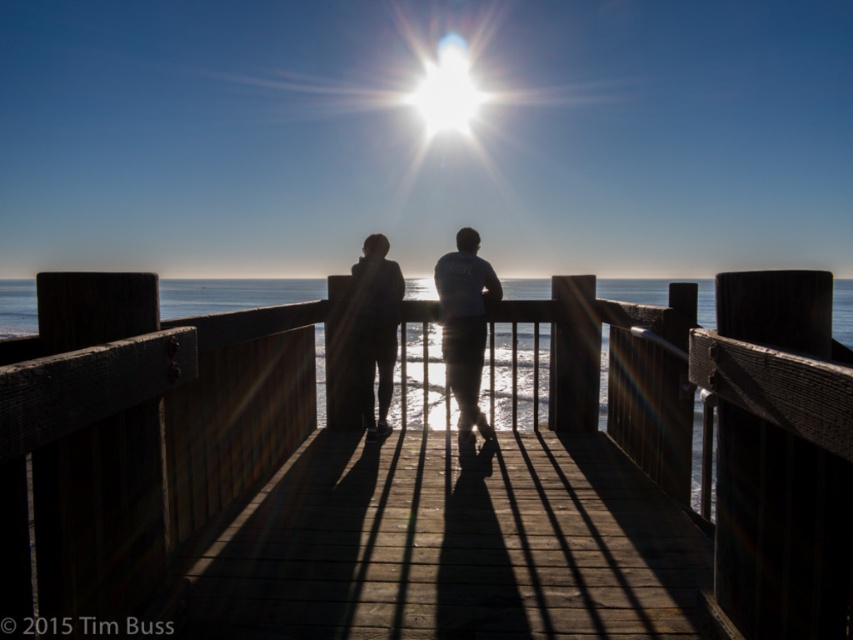
Question: Is transparent water at center closer to the viewer compared to silhouette clothing at center?

Choices:
 (A) no
 (B) yes

Answer: (B)

Question: Which of the following is the closest to the observer?

Choices:
 (A) (161, 292)
 (B) (355, 269)
 (C) (444, 307)
 (D) (485, 432)

Answer: (D)

Question: Observing the image, what is the correct spatial positioning of transparent water at center in reference to silhouette clothing at center?

Choices:
 (A) right
 (B) left

Answer: (B)

Question: Which point appears closest to the camera in this image?

Choices:
 (A) (480, 417)
 (B) (850, 316)

Answer: (A)

Question: Which point appears closest to the camera in this image?

Choices:
 (A) [167, 310]
 (B) [461, 444]
 (C) [383, 321]

Answer: (B)

Question: Can you confirm if white cotton shirt at center is positioned above silhouette fabric at center?

Choices:
 (A) no
 (B) yes

Answer: (B)